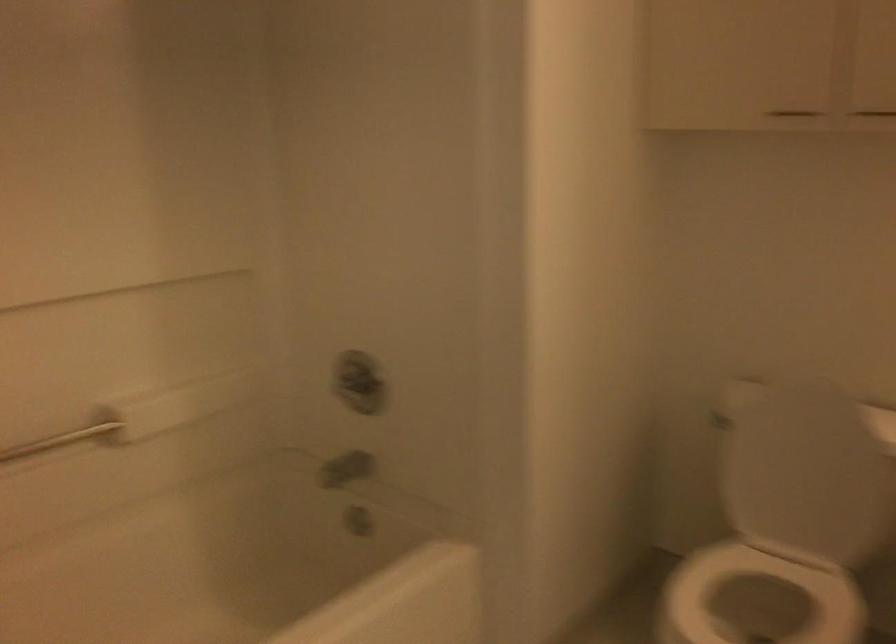
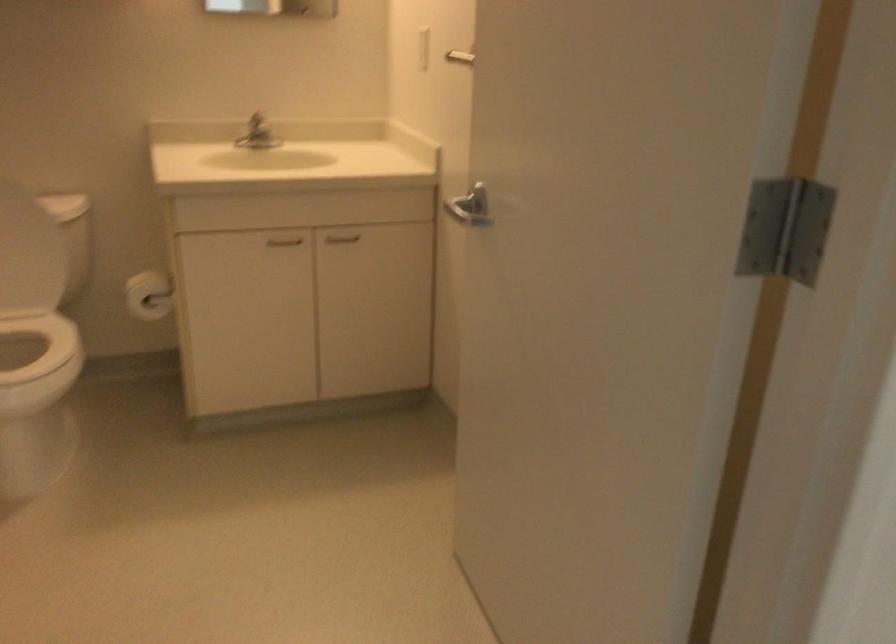
Find the pixel in the second image that matches point 822,430 in the first image.

(12, 210)